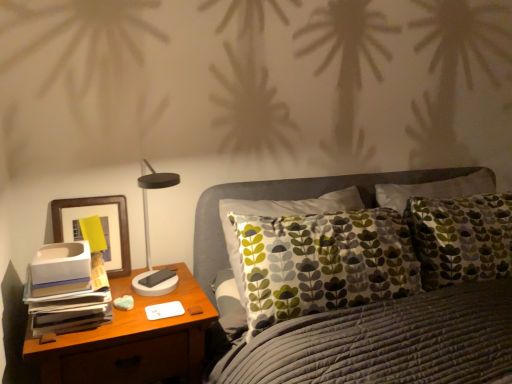
Question: Can you confirm if wooden picture frame at left is wider than wooden nightstand at left?

Choices:
 (A) no
 (B) yes

Answer: (A)

Question: Does wooden picture frame at left contain wooden nightstand at left?

Choices:
 (A) yes
 (B) no

Answer: (B)

Question: From a real-world perspective, is wooden picture frame at left beneath wooden nightstand at left?

Choices:
 (A) no
 (B) yes

Answer: (A)

Question: Is wooden picture frame at left aimed at wooden nightstand at left?

Choices:
 (A) no
 (B) yes

Answer: (A)

Question: Is wooden picture frame at left beside wooden nightstand at left?

Choices:
 (A) yes
 (B) no

Answer: (B)

Question: Does wooden picture frame at left lie in front of wooden nightstand at left?

Choices:
 (A) yes
 (B) no

Answer: (B)

Question: Is wooden nightstand at left in contact with matte black table lamp at left?

Choices:
 (A) yes
 (B) no

Answer: (B)

Question: Is wooden nightstand at left bigger than matte black table lamp at left?

Choices:
 (A) yes
 (B) no

Answer: (A)

Question: Is wooden nightstand at left wider than matte black table lamp at left?

Choices:
 (A) yes
 (B) no

Answer: (A)

Question: Can you confirm if wooden nightstand at left is positioned to the right of matte black table lamp at left?

Choices:
 (A) yes
 (B) no

Answer: (B)

Question: Does wooden nightstand at left lie behind matte black table lamp at left?

Choices:
 (A) no
 (B) yes

Answer: (A)

Question: Considering the relative sizes of wooden nightstand at left and matte black table lamp at left in the image provided, is wooden nightstand at left shorter than matte black table lamp at left?

Choices:
 (A) yes
 (B) no

Answer: (B)

Question: Does matte black table lamp at left appear on the right side of wooden nightstand at left?

Choices:
 (A) no
 (B) yes

Answer: (B)